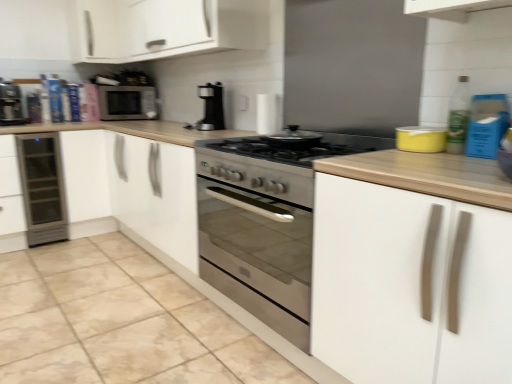
Question: Should I look upward or downward to see black plastic coffee maker at center?

Choices:
 (A) up
 (B) down

Answer: (A)

Question: Considering the relative positions of black plastic coffee maker at center and green plastic bottle at upper right in the image provided, is black plastic coffee maker at center to the right of green plastic bottle at upper right from the viewer's perspective?

Choices:
 (A) yes
 (B) no

Answer: (B)

Question: Can you confirm if black plastic coffee maker at center is taller than green plastic bottle at upper right?

Choices:
 (A) no
 (B) yes

Answer: (B)

Question: Does black plastic coffee maker at center have a lesser height compared to green plastic bottle at upper right?

Choices:
 (A) yes
 (B) no

Answer: (B)

Question: Can you confirm if black plastic coffee maker at center is bigger than green plastic bottle at upper right?

Choices:
 (A) no
 (B) yes

Answer: (B)

Question: From a real-world perspective, does black plastic coffee maker at center sit lower than green plastic bottle at upper right?

Choices:
 (A) yes
 (B) no

Answer: (B)

Question: Considering the relative sizes of black plastic coffee maker at center and green plastic bottle at upper right in the image provided, is black plastic coffee maker at center smaller than green plastic bottle at upper right?

Choices:
 (A) no
 (B) yes

Answer: (A)

Question: Can you confirm if black plastic coffee maker at center is positioned to the right of white matte cabinet at right, arranged as the 2th cabinetry when viewed from the top?

Choices:
 (A) yes
 (B) no

Answer: (B)

Question: From the image's perspective, is black plastic coffee maker at center located above white matte cabinet at right, the 1th cabinetry positioned from the right?

Choices:
 (A) yes
 (B) no

Answer: (A)

Question: Considering the relative positions of black plastic coffee maker at center and white matte cabinet at right, arranged as the 2th cabinetry when viewed from the top, in the image provided, is black plastic coffee maker at center in front of white matte cabinet at right, arranged as the 2th cabinetry when viewed from the top,?

Choices:
 (A) yes
 (B) no

Answer: (B)

Question: Is black plastic coffee maker at center positioned beyond the bounds of white matte cabinet at right, arranged as the 1th cabinetry when ordered from the bottom?

Choices:
 (A) yes
 (B) no

Answer: (A)

Question: Does black plastic coffee maker at center contain white matte cabinet at right, arranged as the 1th cabinetry when ordered from the bottom?

Choices:
 (A) yes
 (B) no

Answer: (B)

Question: From the image's perspective, is black plastic coffee maker at center below white matte cabinet at right, arranged as the 1th cabinetry when ordered from the bottom?

Choices:
 (A) no
 (B) yes

Answer: (A)

Question: Is the depth of matte black microwave at upper left less than that of yellow matte container at upper right, the first appliance in the front-to-back sequence?

Choices:
 (A) no
 (B) yes

Answer: (A)